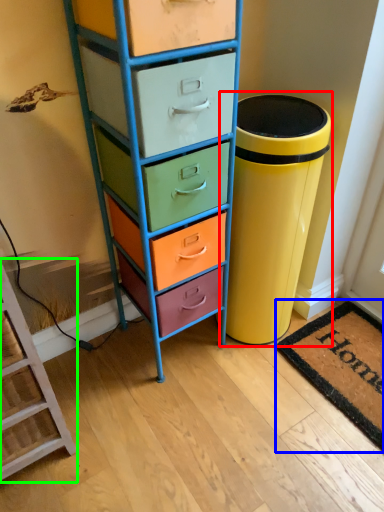
Question: Which is nearer to the waste container (highlighted by a red box)? mat (highlighted by a blue box) or furniture (highlighted by a green box).

Choices:
 (A) mat
 (B) furniture

Answer: (A)